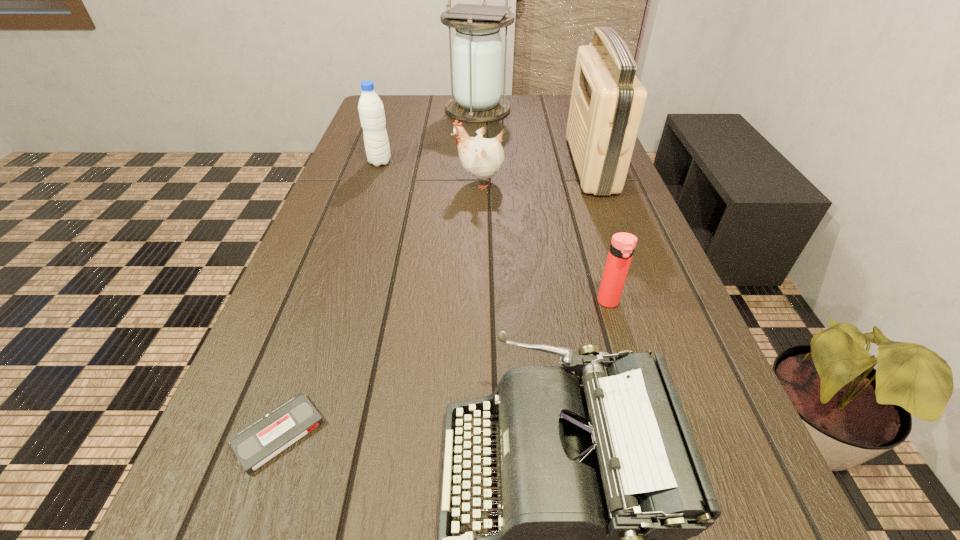
Find the location of `lantern`. lantern is located at coordinates (477, 49).

In order to click on radio receiver in this screenshot , I will do `click(607, 101)`.

Locate an element on the screen. water bottle is located at coordinates point(371,110).

Find the location of `bird`. bird is located at coordinates [x=481, y=157].

Where is `thermos bottle`? thermos bottle is located at coordinates [622, 246].

You are a GUI agent. You are given a task and a screenshot of the screen. Output one action in this format:
    pyautogui.click(x=<x>, y=<y>)
    Task: Click on the shortest object
    The image size is (960, 540).
    Given the screenshot: What is the action you would take?
    pyautogui.click(x=255, y=445)

Identify the location of vacant point located on the left of the farthest object. Image resolution: width=960 pixels, height=540 pixels. (370, 109).

Find the location of a particular element. This screenshot has height=540, width=960. free space located 0.220m on the front-facing side of the radio receiver is located at coordinates (492, 164).

In order to click on free space located on the front-facing side of the radio receiver in this screenshot , I will do `click(465, 164)`.

Find the location of a particular element. This screenshot has width=960, height=540. vacant area located 0.140m on the front-facing side of the radio receiver is located at coordinates (521, 164).